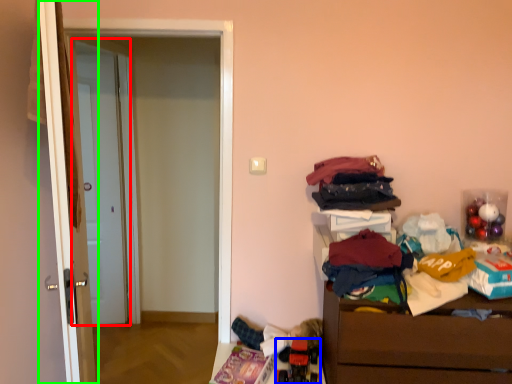
Question: Which object is the farthest from door (highlighted by a red box)? Choose among these: toy (highlighted by a blue box) or door (highlighted by a green box).

Choices:
 (A) toy
 (B) door

Answer: (A)